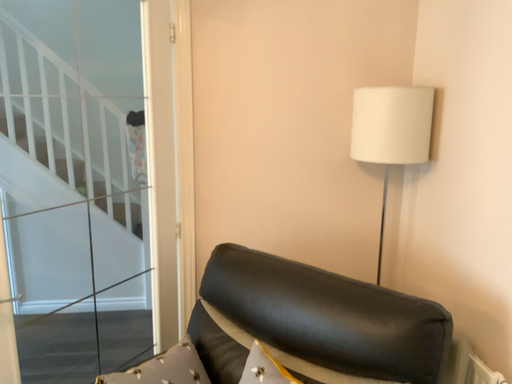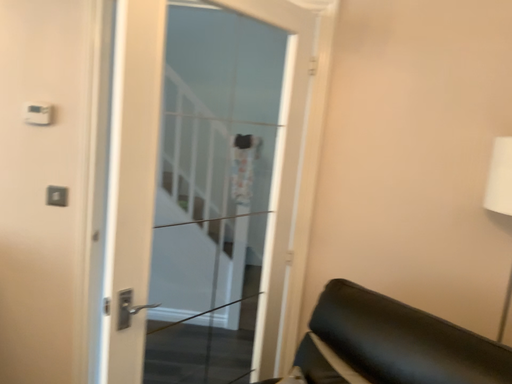
Question: How did the camera likely rotate when shooting the video?

Choices:
 (A) rotated right
 (B) rotated left

Answer: (B)